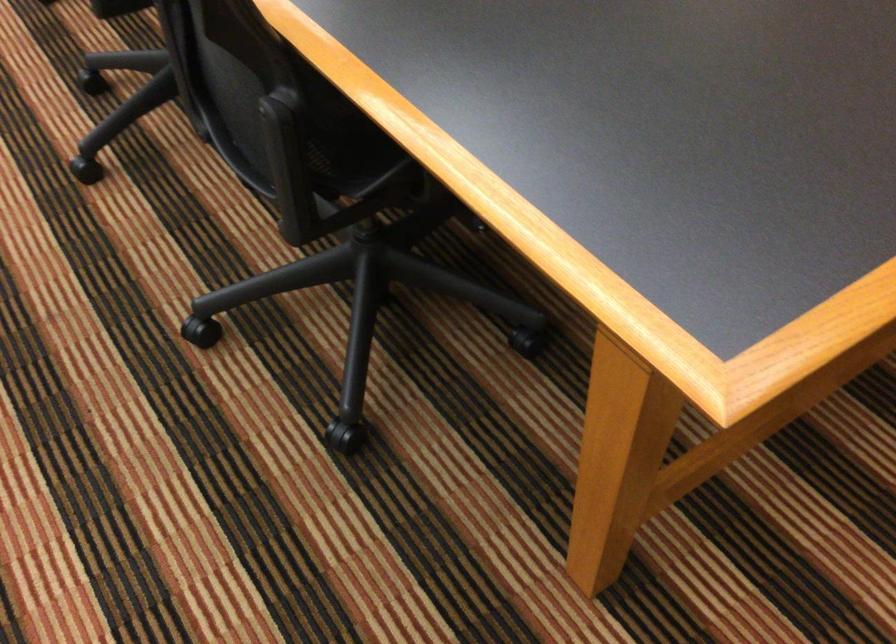
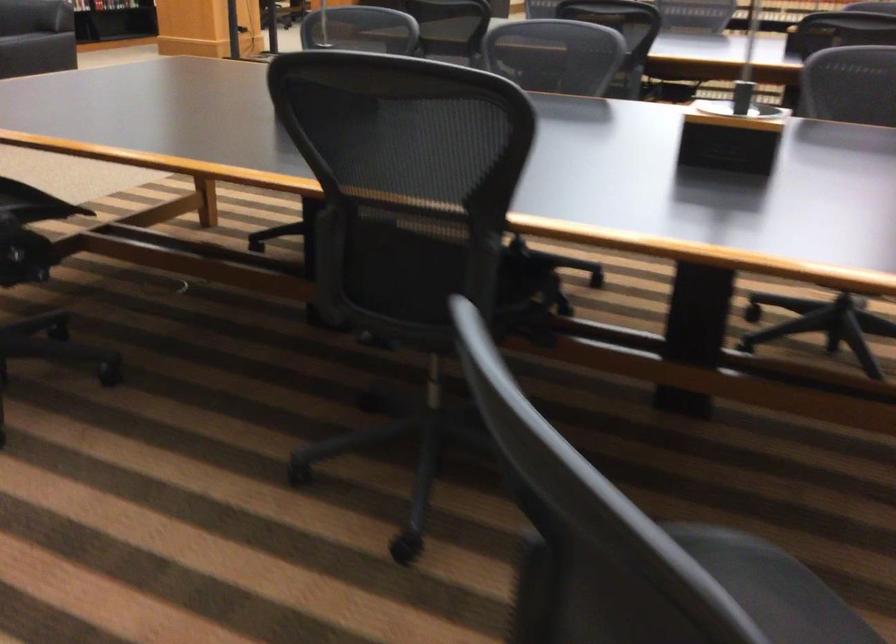
Question: I am providing you with two images of the same scene from different viewpoints. Please identify which objects are invisible in image2.

Choices:
 (A) black chair armrest
 (B) black chair wheel
 (C) chair sitting surface
 (D) bicycle helmet

Answer: (B)